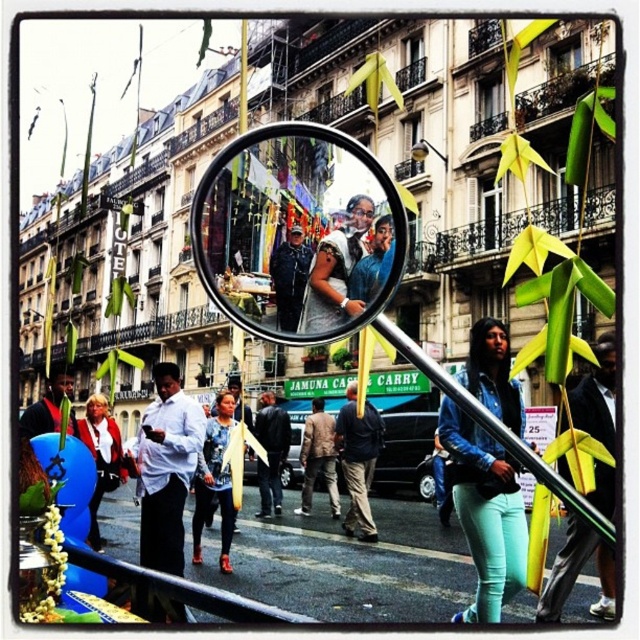
You are a photographer trying to capture a detailed shot of the street scene. You notice two points marked at coordinates point (x=170, y=554) and point (x=193, y=540). Which point should you focus on to ensure it appears clearer in your photo?

Point (x=170, y=554) should be focused on because it is closer to the camera and will appear clearer in the photo compared to point (x=193, y=540), which is farther away.